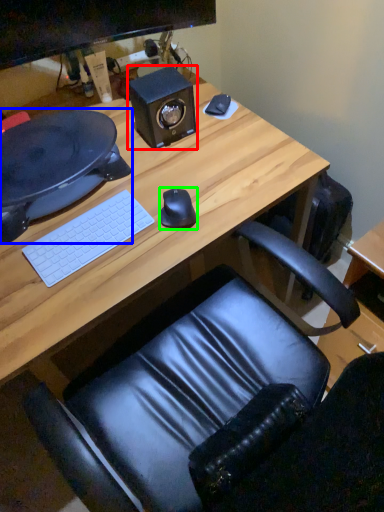
Question: Considering the real-world distances, which object is farthest from speaker (highlighted by a red box)? desktop (highlighted by a blue box) or mouse (highlighted by a green box)?

Choices:
 (A) desktop
 (B) mouse

Answer: (B)